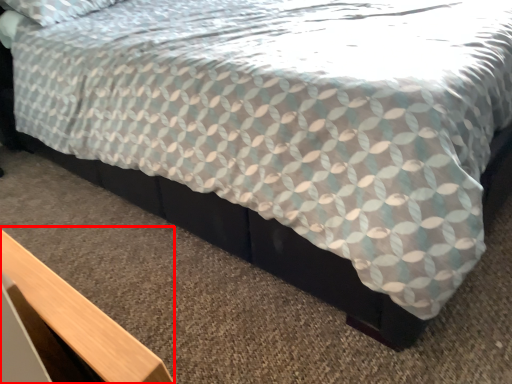
Question: From the image's perspective, what is the correct spatial relationship of table (annotated by the red box) in relation to bed frame?

Choices:
 (A) below
 (B) above

Answer: (A)